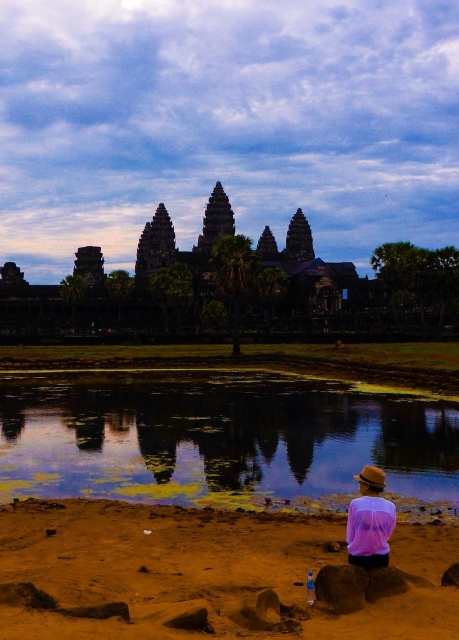
Question: Which object is positioned closest to the green algae water at lower center?

Choices:
 (A) brown sandy beach at lower right
 (B) smooth brown rock at lower center

Answer: (A)

Question: Is pink sheer blouse at lower right wider than smooth brown rock at lower center?

Choices:
 (A) no
 (B) yes

Answer: (B)

Question: Does green algae water at lower center have a lesser width compared to pink sheer blouse at lower right?

Choices:
 (A) yes
 (B) no

Answer: (B)

Question: Among these objects, which one is farthest from the camera?

Choices:
 (A) green algae water at lower center
 (B) brown sandy beach at lower right
 (C) pink sheer blouse at lower right
 (D) smooth brown rock at lower center

Answer: (A)

Question: Among these points, which one is nearest to the camera?

Choices:
 (A) (367, 628)
 (B) (337, 598)
 (C) (173, 465)

Answer: (A)

Question: Can you confirm if pink sheer blouse at lower right is positioned below smooth brown rock at lower center?

Choices:
 (A) no
 (B) yes

Answer: (A)